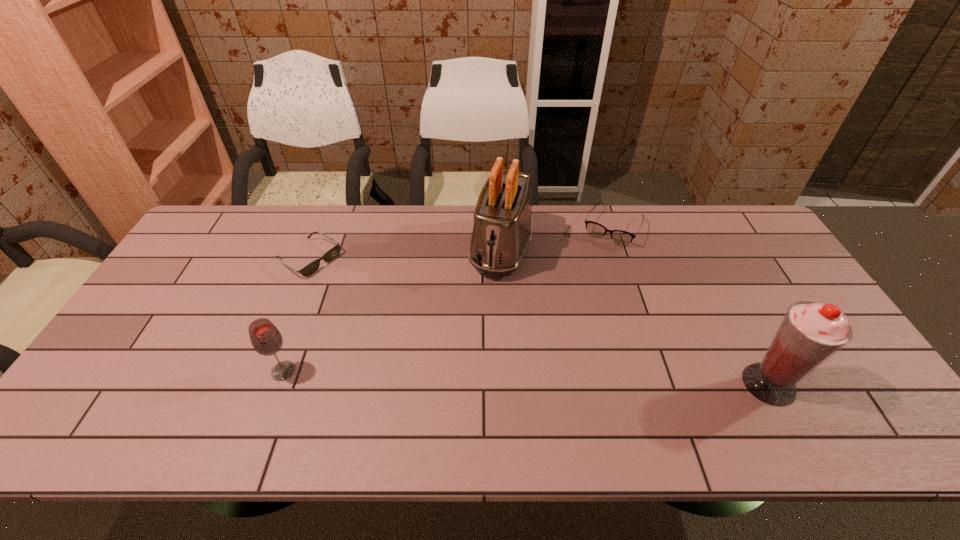
Where is `free space in the image that satisfies the following two spatial constraints: 1. on the front side of the smoothie; 2. on the left side of the toaster`? free space in the image that satisfies the following two spatial constraints: 1. on the front side of the smoothie; 2. on the left side of the toaster is located at coordinates (509, 384).

Where is `vacant region that satisfies the following two spatial constraints: 1. on the back side of the second shortest object; 2. on the right side of the shortest object`? The height and width of the screenshot is (540, 960). vacant region that satisfies the following two spatial constraints: 1. on the back side of the second shortest object; 2. on the right side of the shortest object is located at coordinates (322, 227).